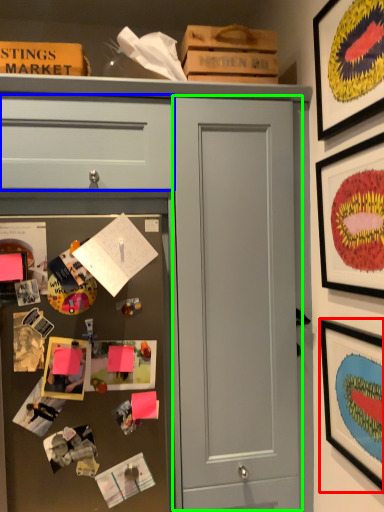
Question: Based on their relative distances, which object is farther from picture frame (highlighted by a red box)? Choose from drawer (highlighted by a blue box) and door (highlighted by a green box).

Choices:
 (A) drawer
 (B) door

Answer: (A)